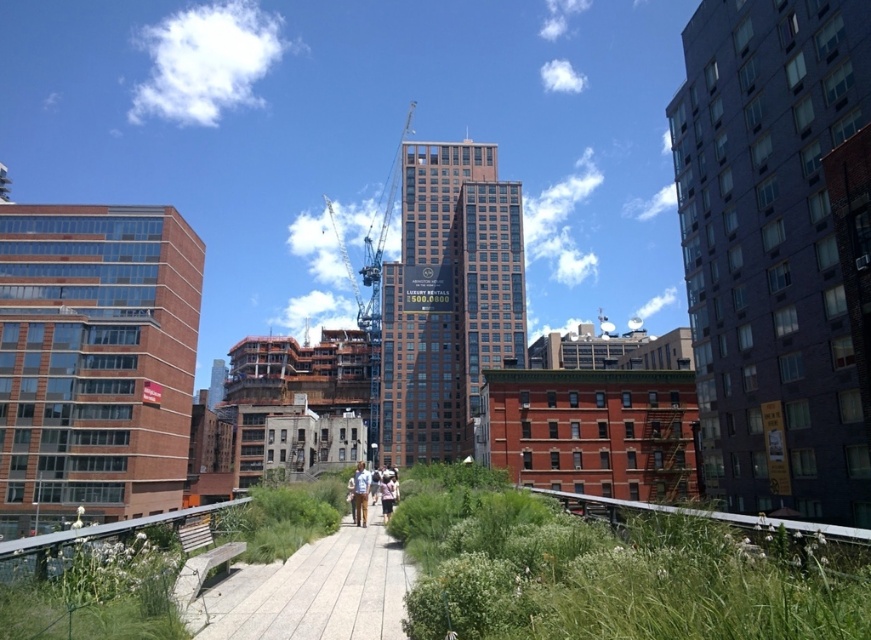
Question: Is wooden at center below light blue shirt at center?

Choices:
 (A) no
 (B) yes

Answer: (A)

Question: Which object appears closest to the camera in this image?

Choices:
 (A) light blue shirt at center
 (B) green grass at lower center
 (C) wooden at center

Answer: (B)

Question: Where is green grass at lower center located in relation to wooden at center in the image?

Choices:
 (A) above
 (B) below

Answer: (A)

Question: Which of these objects is positioned closest to the wooden at center?

Choices:
 (A) light blue shirt at center
 (B) green grass at lower center
 (C) matte white shirt at center

Answer: (B)

Question: Can you confirm if matte white shirt at center is positioned above light blue shirt at center?

Choices:
 (A) no
 (B) yes

Answer: (B)

Question: Which of these objects is positioned closest to the light brown leather jacket at center?

Choices:
 (A) wooden at center
 (B) matte white shirt at center

Answer: (B)